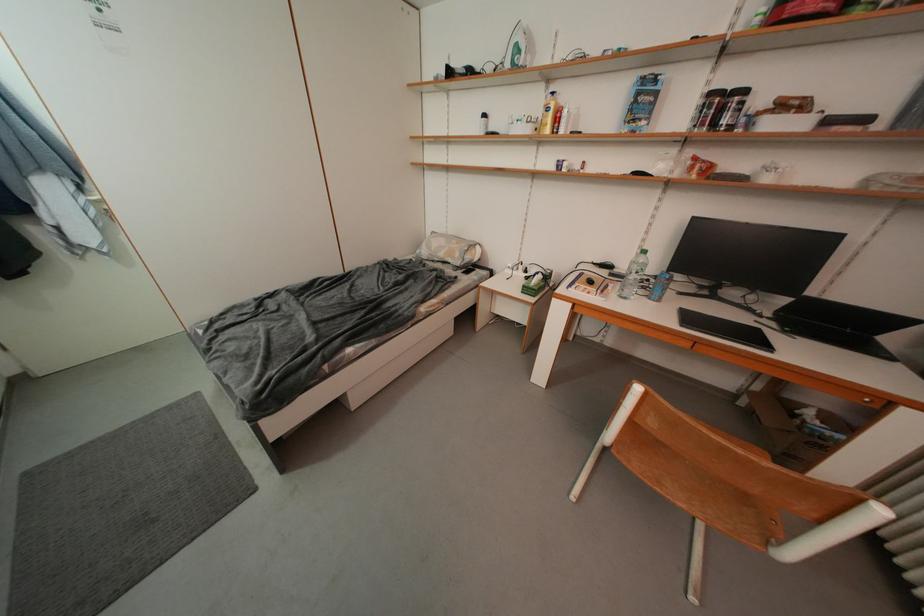
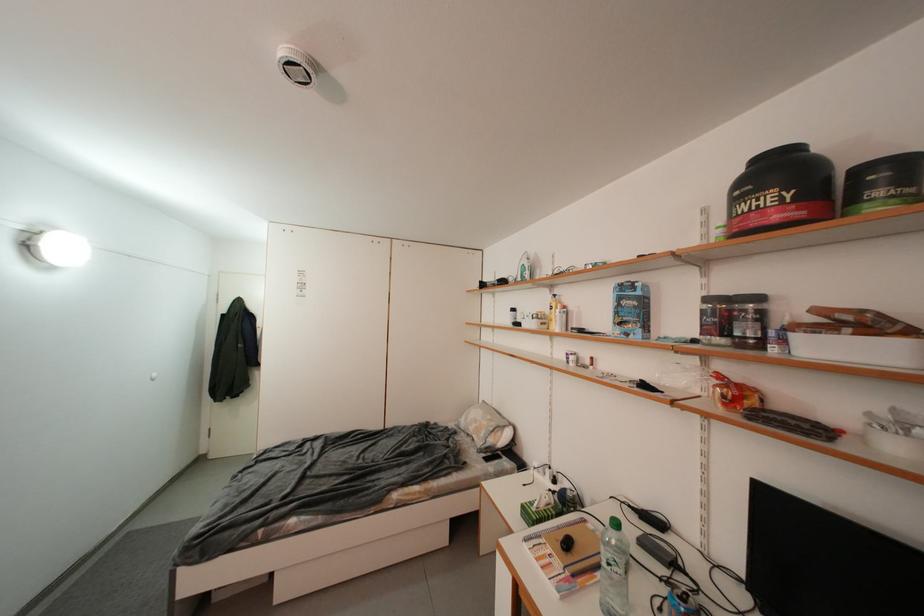
Where in the second image is the point corresponding to the point at 757,128 from the first image?

(792, 345)